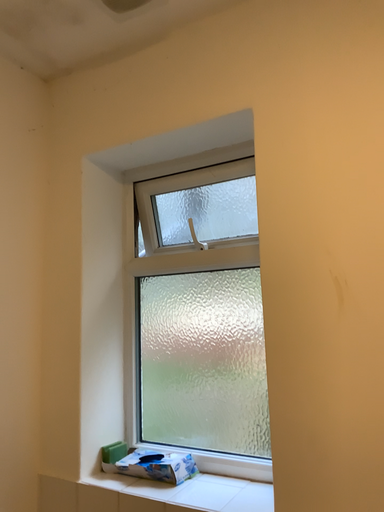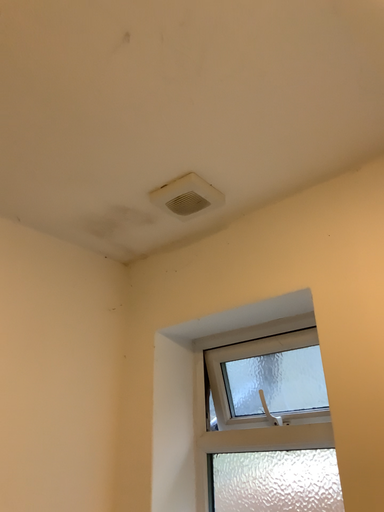
Question: How did the camera likely rotate when shooting the video?

Choices:
 (A) rotated right
 (B) rotated left

Answer: (B)